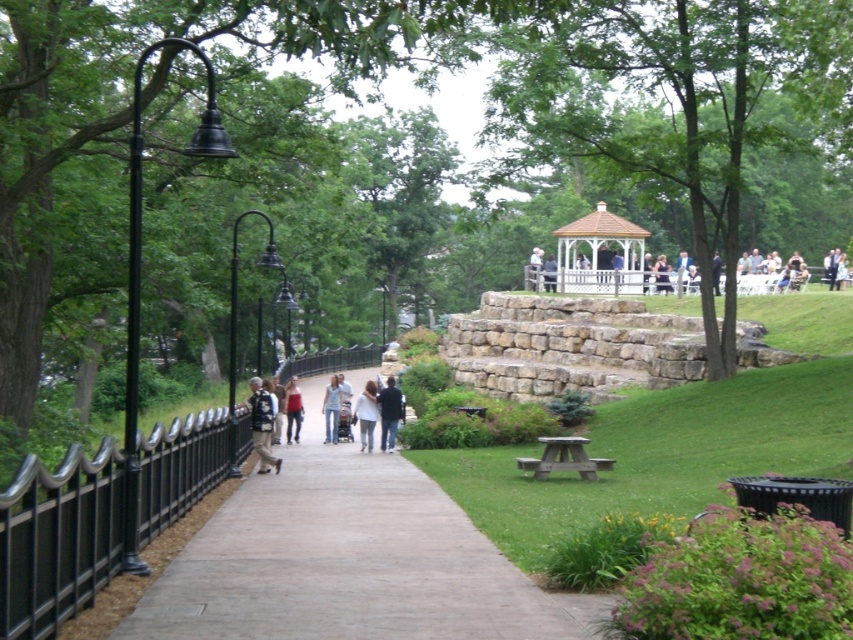
You are a photographer standing at the end of the pathway. You want to take a photo that includes both the denim jacket at center and the denim jeans at center. Which object should you focus on first if you want to ensure both are in the frame?

The denim jacket at center is shorter than the denim jeans at center. To ensure both are in the frame, focus on the denim jacket at center first since it is closer to the camera, allowing the jeans to be captured in the background.

You are a park visitor who wants to set up a small picnic basket on the wooden picnic table at center. However, there is a person wearing a matte red shirt at center sitting there. Can you place your picnic basket on the table without displacing the person?

The wooden picnic table at center occupies less space than the matte red shirt at center, meaning the table is smaller. Since the person is already occupying the table, there might not be enough space for your picnic basket without displacing them.

You are standing at the point with coordinates point (602,280) in the park. Which object are you standing on?

You are standing on the white wooden gazebo at center.